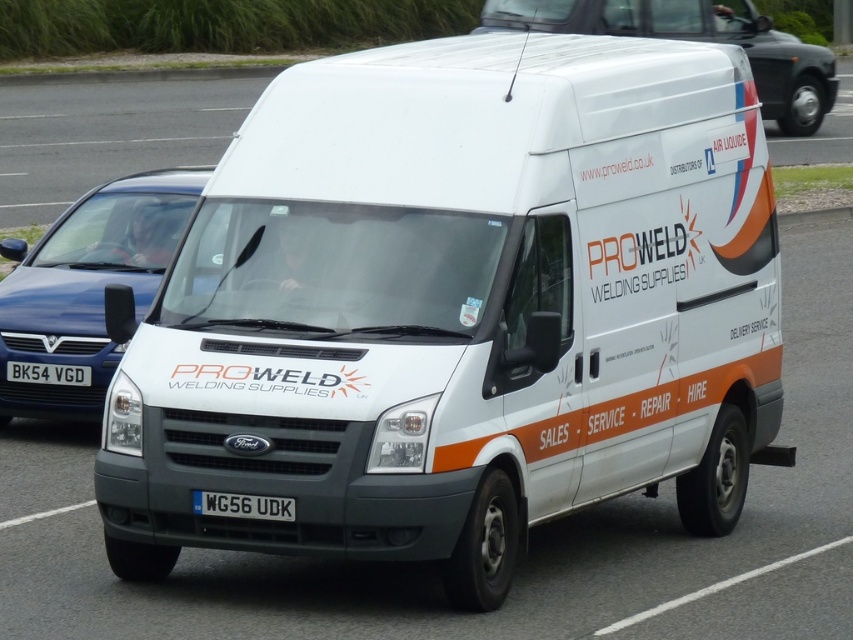
Can you confirm if white matte van at upper center is shorter than white plastic license plate at center?

In fact, white matte van at upper center may be taller than white plastic license plate at center.

Does white matte van at upper center appear on the left side of white plastic license plate at center?

Incorrect, white matte van at upper center is not on the left side of white plastic license plate at center.

Is point (740, 33) positioned behind point (219, 497)?

Yes, it is.

Locate an element on the screen. white matte van at upper center is located at coordinates (695, 38).

Which is behind, point (682, 10) or point (88, 376)?

The point (682, 10) is behind.

Is point (675, 1) farther from viewer compared to point (30, 362)?

Yes, it is behind point (30, 362).

Is point (759, 81) positioned behind point (6, 371)?

Yes, point (759, 81) is farther from viewer.

Image resolution: width=853 pixels, height=640 pixels. Find the location of `white matte van at upper center`. white matte van at upper center is located at coordinates (695, 38).

Is point (86, 413) positioned after point (828, 104)?

That is False.

Between point (196, 179) and point (746, 45), which one is positioned behind?

Point (746, 45)

Does point (57, 292) lie in front of point (781, 90)?

Yes.

I want to click on white matte van at center, so click(86, 285).